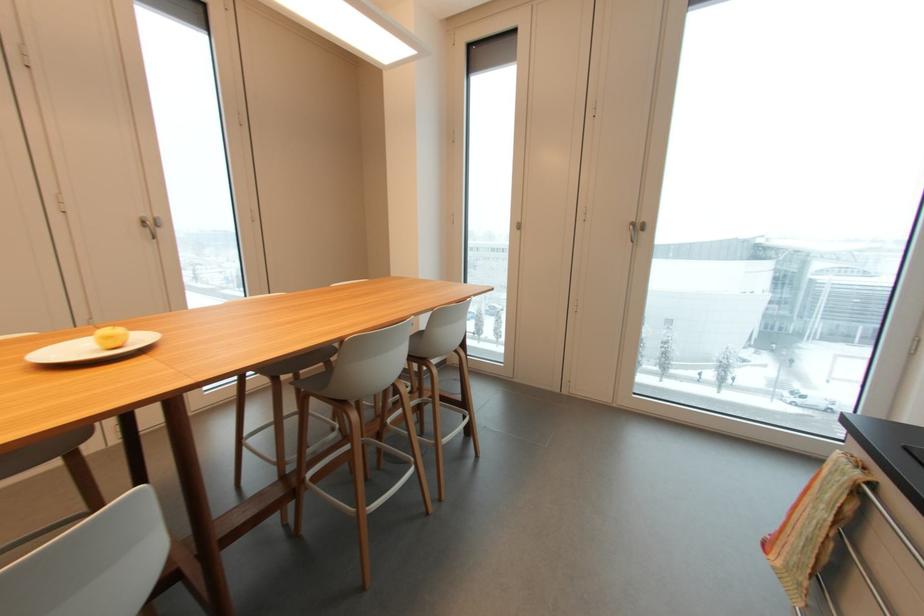
The location [111,337] corresponds to which object?

It corresponds to the yellow apple in the image.